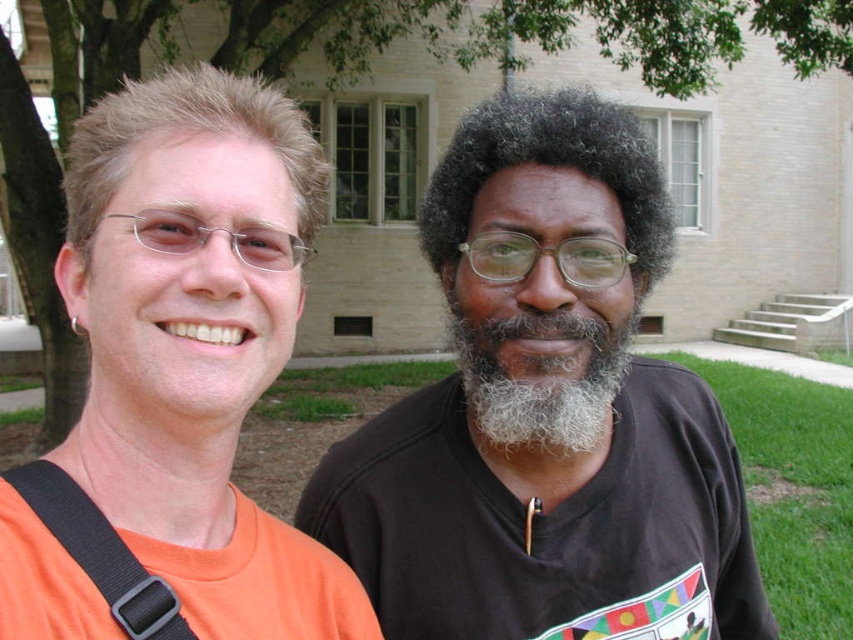
Who is higher up, orange matte t-shirt at left or gray fuzzy beard at center?

orange matte t-shirt at left

Is the position of orange matte t-shirt at left more distant than that of gray fuzzy beard at center?

That is False.

Does point (282, 179) come farther from viewer compared to point (570, 320)?

That is False.

Find the location of a particular element. This screenshot has width=853, height=640. orange matte t-shirt at left is located at coordinates (175, 378).

Does black matte shirt at center have a greater width compared to gray fuzzy beard at center?

Indeed, black matte shirt at center has a greater width compared to gray fuzzy beard at center.

Between black matte shirt at center and gray fuzzy beard at center, which one appears on the right side from the viewer's perspective?

Positioned to the right is black matte shirt at center.

Find the location of a particular element. black matte shirt at center is located at coordinates (546, 412).

Which is below, black matte shirt at center or orange matte t-shirt at left?

black matte shirt at center

Which is behind, point (543, 244) or point (276, 268)?

Positioned behind is point (543, 244).

Find the location of a particular element. black matte shirt at center is located at coordinates (546, 412).